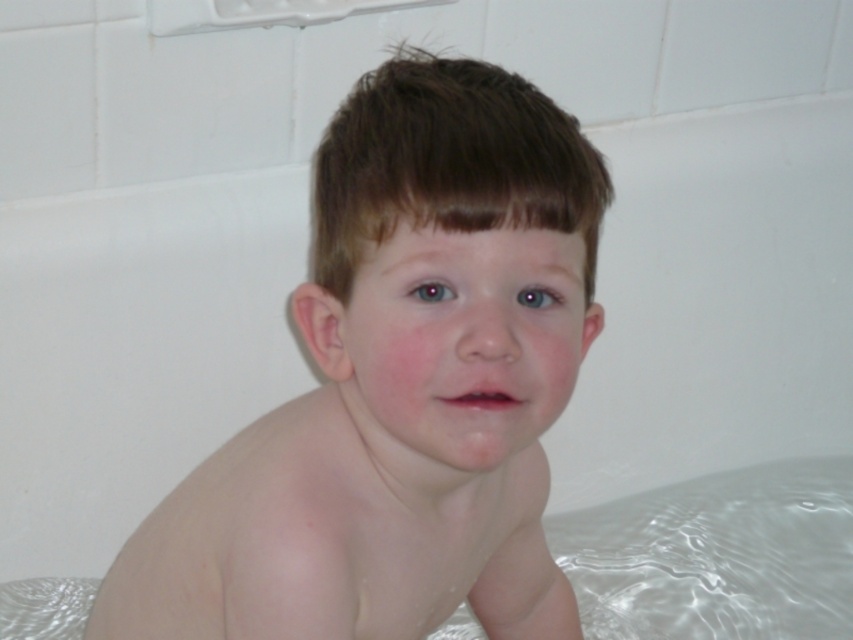
Is pale skin child at center above transparent plastic diaper at lower left?

Yes.

Looking at this image, who is positioned more to the left, pale skin child at center or transparent plastic diaper at lower left?

transparent plastic diaper at lower left is more to the left.

Is point (515, 460) farther from viewer compared to point (74, 602)?

No, (515, 460) is closer to viewer.

Identify the location of pale skin child at center. (399, 385).